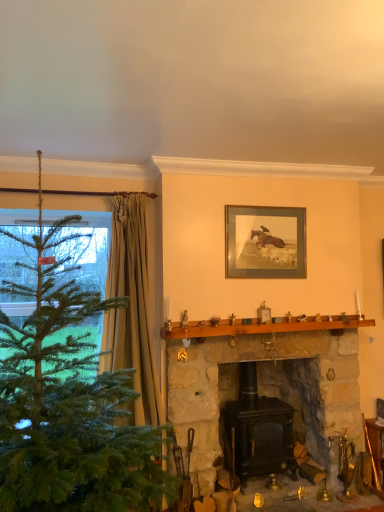
The width and height of the screenshot is (384, 512). What do you see at coordinates (265, 379) in the screenshot?
I see `stone fireplace at center, which is the 1th fireplace in left-to-right order` at bounding box center [265, 379].

Describe the element at coordinates (255, 425) in the screenshot. I see `black matte wood stove at center, the 1th fireplace in the right-to-left sequence` at that location.

Where is `wooden fireplace tools at lower right`? wooden fireplace tools at lower right is located at coordinates (374, 446).

This screenshot has height=512, width=384. In order to click on wooden frame at upper center in this screenshot , I will do `click(265, 242)`.

Considering the relative sizes of green matte christmas tree at left and brown wooden mantle at center in the image provided, is green matte christmas tree at left thinner than brown wooden mantle at center?

In fact, green matte christmas tree at left might be wider than brown wooden mantle at center.

Is green matte christmas tree at left in front of brown wooden mantle at center?

Yes, green matte christmas tree at left is closer to the viewer.

Which of these two, green matte christmas tree at left or brown wooden mantle at center, is smaller?

brown wooden mantle at center.

Does green matte christmas tree at left contain brown wooden mantle at center?

Actually, brown wooden mantle at center is outside green matte christmas tree at left.

Is green matte christmas tree at left a part of wooden fireplace tools at lower right?

Definitely not — green matte christmas tree at left is not inside wooden fireplace tools at lower right.

Is point (374, 476) farther from viewer compared to point (35, 444)?

Yes.

Locate an element on the screen. christmas tree on the left of the wooden fireplace tools at lower right is located at coordinates (69, 403).

Is wooden fireplace tools at lower right placed right next to green matte christmas tree at left?

No, wooden fireplace tools at lower right is not next to green matte christmas tree at left.

Image resolution: width=384 pixels, height=512 pixels. Find the location of `christmas tree in front of the black matte wood stove at center, acting as the second fireplace starting from the left`. christmas tree in front of the black matte wood stove at center, acting as the second fireplace starting from the left is located at coordinates (69, 403).

Can you tell me how much green matte christmas tree at left and black matte wood stove at center, the 1th fireplace in the right-to-left sequence, differ in facing direction?

The angular difference between green matte christmas tree at left and black matte wood stove at center, the 1th fireplace in the right-to-left sequence, is 4.59 degrees.

Could you tell me if green matte christmas tree at left is turned towards black matte wood stove at center, the 1th fireplace in the right-to-left sequence?

No, green matte christmas tree at left is not turned towards black matte wood stove at center, the 1th fireplace in the right-to-left sequence.

Between green matte christmas tree at left and black matte wood stove at center, the 1th fireplace in the right-to-left sequence, which one has more height?

green matte christmas tree at left.

Does beige textured curtain at left come in front of black matte wood stove at center, the 1th fireplace in the right-to-left sequence?

That is True.

Which of these two, beige textured curtain at left or black matte wood stove at center, the 1th fireplace in the right-to-left sequence, is bigger?

beige textured curtain at left is bigger.

This screenshot has height=512, width=384. What are the coordinates of `curtain on the left of the black matte wood stove at center, the 1th fireplace in the right-to-left sequence` in the screenshot? It's located at (131, 308).

Are beige textured curtain at left and black matte wood stove at center, the 1th fireplace in the right-to-left sequence, making contact?

There is a gap between beige textured curtain at left and black matte wood stove at center, the 1th fireplace in the right-to-left sequence.

Is there a large distance between green matte christmas tree at left and wooden frame at upper center?

Yes.

Is green matte christmas tree at left further to the viewer compared to wooden frame at upper center?

No.

From a real-world perspective, is green matte christmas tree at left on wooden frame at upper center?

No, from a real-world perspective, green matte christmas tree at left is not over wooden frame at upper center

Relative to green matte christmas tree at left, is wooden frame at upper center in front or behind?

wooden frame at upper center is positioned farther from the viewer than green matte christmas tree at left.

Considering the positions of objects wooden frame at upper center and green matte christmas tree at left in the image provided, who is more to the right, wooden frame at upper center or green matte christmas tree at left?

From the viewer's perspective, wooden frame at upper center appears more on the right side.

From the image's perspective, is wooden frame at upper center positioned above or below green matte christmas tree at left?

Clearly, from the image's perspective, wooden frame at upper center is above green matte christmas tree at left.

Does wooden frame at upper center have a lesser width compared to green matte christmas tree at left?

Yes, wooden frame at upper center is thinner than green matte christmas tree at left.

Is beige textured curtain at left facing away from wooden frame at upper center?

No, beige textured curtain at left is not facing the opposite direction of wooden frame at upper center.

Is beige textured curtain at left next to wooden frame at upper center?

No, beige textured curtain at left is not with wooden frame at upper center.

Is beige textured curtain at left at the right side of wooden frame at upper center?

No, beige textured curtain at left is not to the right of wooden frame at upper center.

Identify the location of christmas tree located in front of the brown wooden mantle at center. The width and height of the screenshot is (384, 512). (69, 403).

Where is `furniture on the right of green matte christmas tree at left`? This screenshot has width=384, height=512. furniture on the right of green matte christmas tree at left is located at coordinates (374, 446).

Estimate the real-world distances between objects in this image. Which object is further from green matte christmas tree at left, beige textured curtain at left or black matte wood stove at center, acting as the second fireplace starting from the left?

black matte wood stove at center, acting as the second fireplace starting from the left.

Looking at the image, which one is located closer to wooden fireplace tools at lower right, black matte wood stove at center, the 1th fireplace in the right-to-left sequence, or stone fireplace at center, the 2th fireplace viewed from the right?

The object closer to wooden fireplace tools at lower right is stone fireplace at center, the 2th fireplace viewed from the right.

Based on their spatial positions, is stone fireplace at center, which is the 1th fireplace in left-to-right order, or brown wooden mantle at center further from wooden frame at upper center?

The object further to wooden frame at upper center is stone fireplace at center, which is the 1th fireplace in left-to-right order.

Estimate the real-world distances between objects in this image. Which object is closer to green matte christmas tree at left, brown wooden mantle at center or wooden fireplace tools at lower right?

The object closer to green matte christmas tree at left is brown wooden mantle at center.

From the image, which object appears to be nearer to wooden fireplace tools at lower right, beige textured curtain at left or wooden frame at upper center?

wooden frame at upper center is positioned closer to the anchor wooden fireplace tools at lower right.

Based on their spatial positions, is stone fireplace at center, the 2th fireplace viewed from the right, or black matte wood stove at center, acting as the second fireplace starting from the left, further from green matte christmas tree at left?

black matte wood stove at center, acting as the second fireplace starting from the left, is positioned further to the anchor green matte christmas tree at left.

Which object lies further to the anchor point stone fireplace at center, which is the 1th fireplace in left-to-right order, green matte christmas tree at left or wooden frame at upper center?

green matte christmas tree at left is positioned further to the anchor stone fireplace at center, which is the 1th fireplace in left-to-right order.

Considering their positions, is brown wooden mantle at center positioned further to beige textured curtain at left than wooden frame at upper center?

wooden frame at upper center lies further to beige textured curtain at left than the other object.

You are a GUI agent. You are given a task and a screenshot of the screen. Output one action in this format:
    pyautogui.click(x=<x>, y=<y>)
    Task: Click on the curtain between green matte christmas tree at left and wooden frame at upper center in the front-back direction
    This screenshot has height=512, width=384.
    Given the screenshot: What is the action you would take?
    pyautogui.click(x=131, y=308)

Locate an element on the screen. curtain between green matte christmas tree at left and brown wooden mantle at center in the front-back direction is located at coordinates (131, 308).

The height and width of the screenshot is (512, 384). What are the coordinates of `mantle that lies between wooden frame at upper center and black matte wood stove at center, the 1th fireplace in the right-to-left sequence, from top to bottom` in the screenshot? It's located at (261, 326).

This screenshot has width=384, height=512. I want to click on fireplace that lies between brown wooden mantle at center and black matte wood stove at center, the 1th fireplace in the right-to-left sequence, from top to bottom, so click(x=265, y=379).